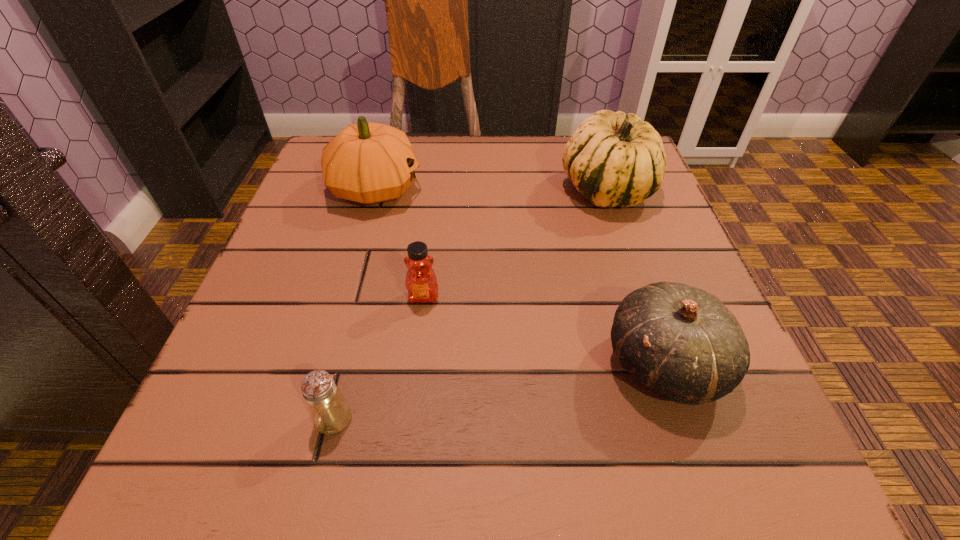
The width and height of the screenshot is (960, 540). I want to click on object situated at the near edge, so click(x=330, y=412).

Identify the location of gourd that is at the left edge. This screenshot has height=540, width=960. (367, 162).

Where is `saltshaker present at the left edge`? This screenshot has width=960, height=540. saltshaker present at the left edge is located at coordinates (330, 412).

I want to click on object present at the far left corner, so click(x=367, y=162).

I want to click on object present at the near left corner, so click(330, 412).

The height and width of the screenshot is (540, 960). Find the location of `object present at the far right corner`. object present at the far right corner is located at coordinates (613, 159).

This screenshot has width=960, height=540. What are the coordinates of `free space at the far edge of the desktop` in the screenshot? It's located at (523, 160).

Find the location of `vacant area at the near edge`. vacant area at the near edge is located at coordinates (387, 460).

Find the location of a particular element. vacant space at the left edge of the desktop is located at coordinates (251, 401).

In order to click on vacant area at the right edge in this screenshot , I will do `click(643, 217)`.